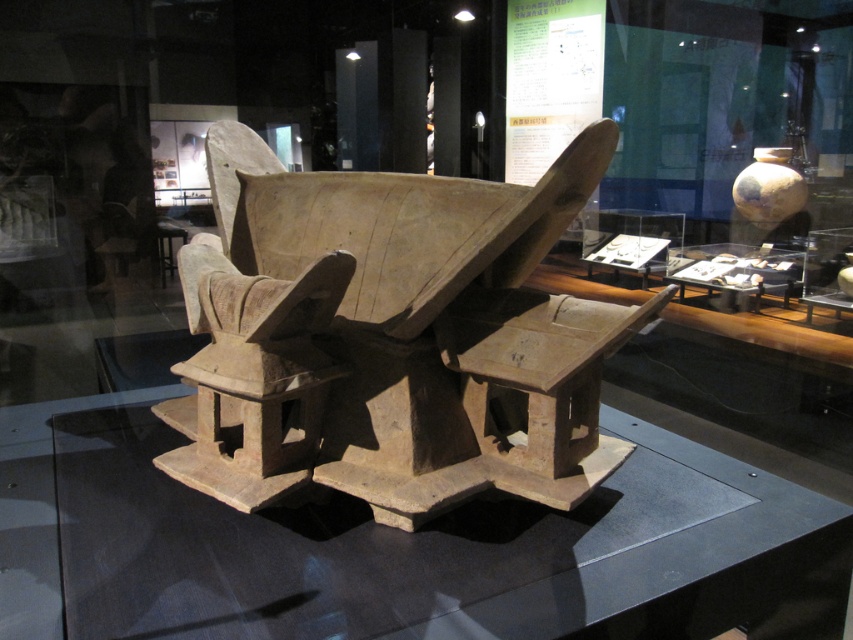
Is brown clay structure at center shorter than transparent glass table at center?

No.

You are a GUI agent. You are given a task and a screenshot of the screen. Output one action in this format:
    pyautogui.click(x=<x>, y=<y>)
    Task: Click on the brown clay structure at center
    
    Given the screenshot: What is the action you would take?
    pyautogui.click(x=392, y=337)